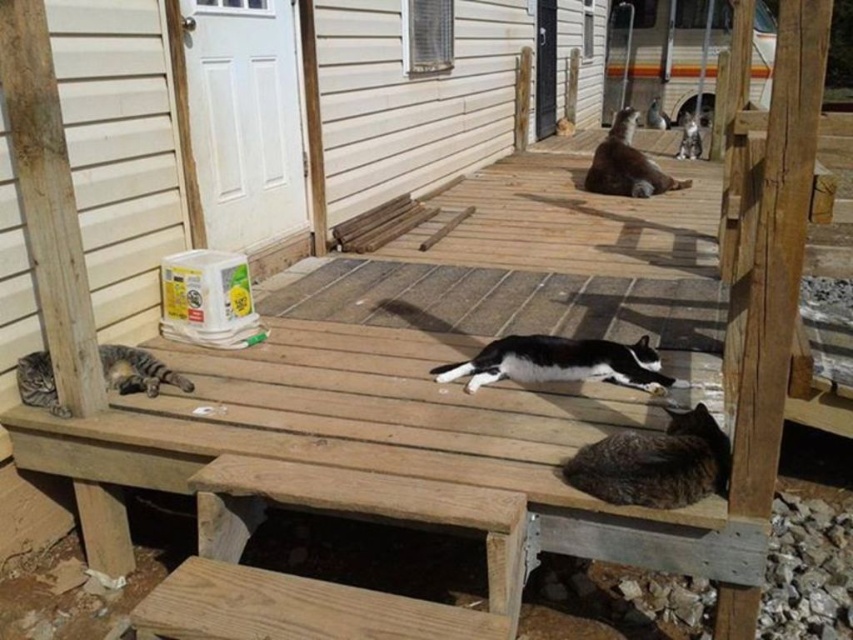
Does black and white fur cat at center have a greater height compared to brown fur cat at upper center?

In fact, black and white fur cat at center may be shorter than brown fur cat at upper center.

Consider the image. Who is more forward, (532, 346) or (619, 112)?

Positioned in front is point (532, 346).

Find the location of a particular element. The width and height of the screenshot is (853, 640). black and white fur cat at center is located at coordinates (560, 362).

At what (x,y) coordinates should I click in order to perform the action: click on black and white fur cat at center. Please return your answer as a coordinate pair (x, y). This screenshot has height=640, width=853. Looking at the image, I should click on (560, 362).

How much distance is there between brown speckled fur cat at lower right and striped fur cat at lower left?

brown speckled fur cat at lower right and striped fur cat at lower left are 1.72 meters apart from each other.

Does brown speckled fur cat at lower right lie behind striped fur cat at lower left?

No, it is in front of striped fur cat at lower left.

Locate an element on the screen. This screenshot has width=853, height=640. brown speckled fur cat at lower right is located at coordinates point(654,464).

Identify the location of brown speckled fur cat at lower right. The image size is (853, 640). (654, 464).

Between black and white fur cat at center and striped fur cat at lower left, which one is positioned higher?

black and white fur cat at center is higher up.

Looking at this image, does black and white fur cat at center have a lesser width compared to striped fur cat at lower left?

Incorrect, black and white fur cat at center's width is not less than striped fur cat at lower left's.

Locate an element on the screen. black and white fur cat at center is located at coordinates (560, 362).

This screenshot has width=853, height=640. In order to click on black and white fur cat at center in this screenshot , I will do click(x=560, y=362).